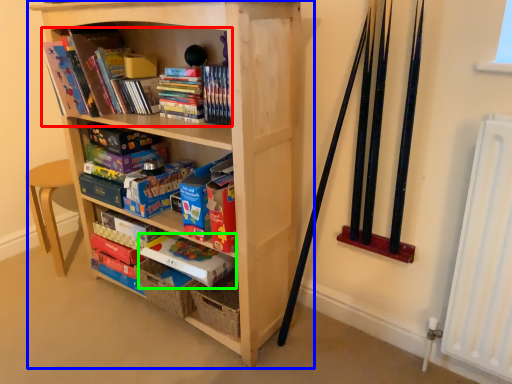
Question: Based on their relative distances, which object is farther from book (highlighted by a red box)? Choose from bookcase (highlighted by a blue box) and paperback book (highlighted by a green box).

Choices:
 (A) bookcase
 (B) paperback book

Answer: (B)